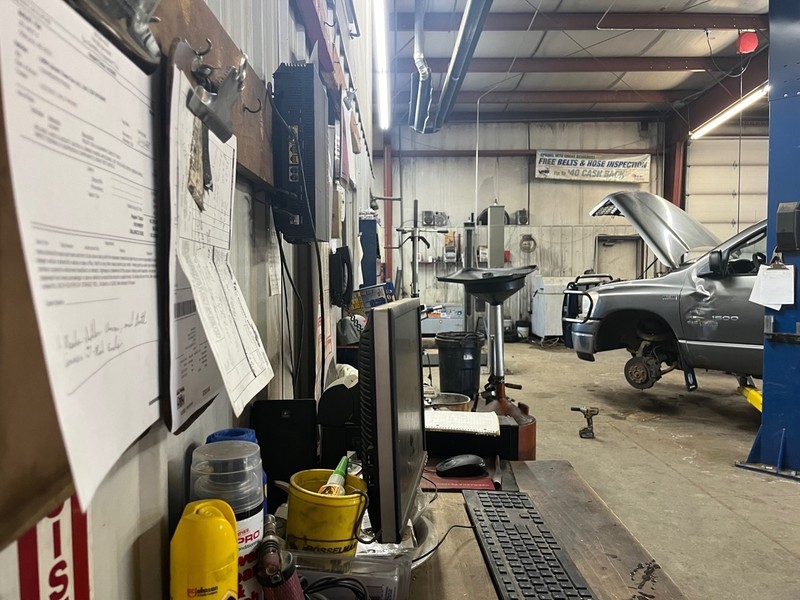
Find the location of a particular element. This screenshot has height=600, width=800. hook is located at coordinates (184, 40).